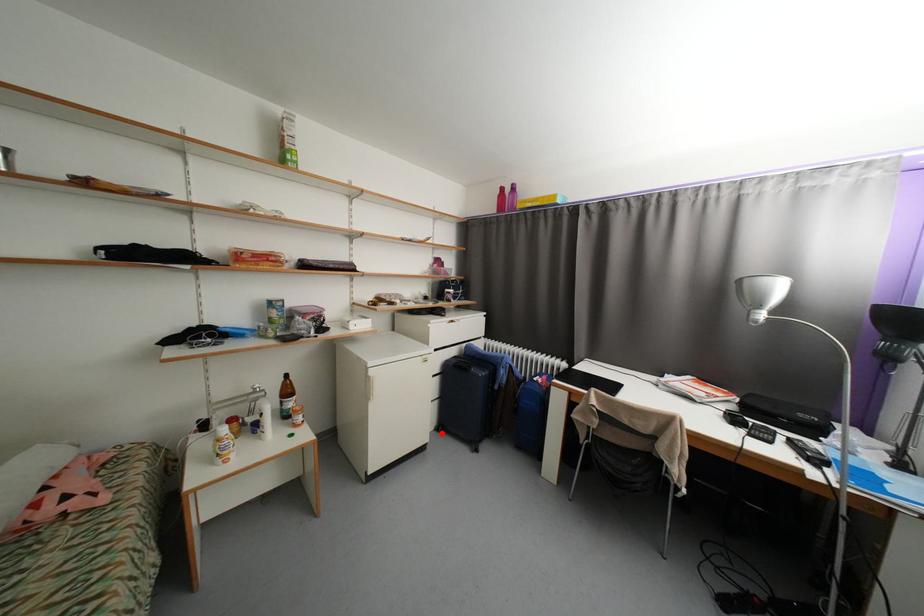
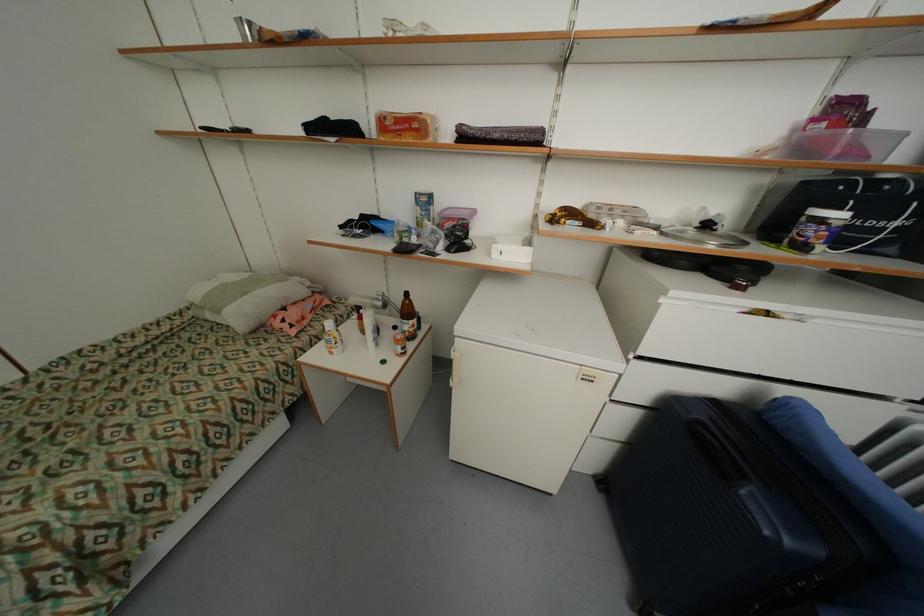
Question: I am providing you with two images of the same scene from different viewpoints. Image1 has a red point marked. In image2, the corresponding 3D location appears at what relative position? Reply with the corresponding letter.

Choices:
 (A) Closer
 (B) Farther

Answer: (A)